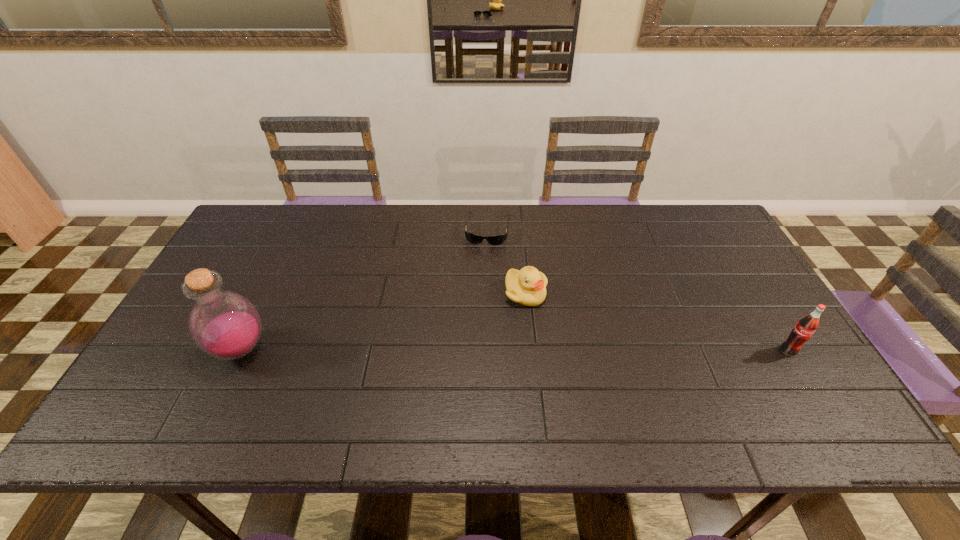
At what (x,y) coordinates should I click in order to perform the action: click on free space on the desktop that is between the bottle and the rightmost object and is positioned on the front-facing side of the shortest object. Please return your answer as a coordinate pair (x, y). The height and width of the screenshot is (540, 960). Looking at the image, I should click on (468, 350).

The image size is (960, 540). What are the coordinates of `vacant space on the desktop that is between the leftmost object and the rightmost object and is positioned on the front-facing side of the second shortest object` in the screenshot? It's located at click(x=545, y=350).